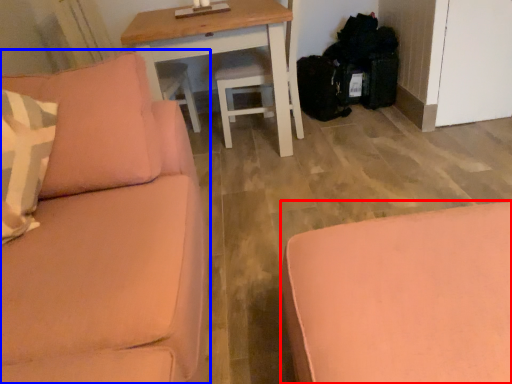
Question: Which object is further to the camera taking this photo, studio couch (highlighted by a red box) or studio couch (highlighted by a blue box)?

Choices:
 (A) studio couch
 (B) studio couch

Answer: (A)